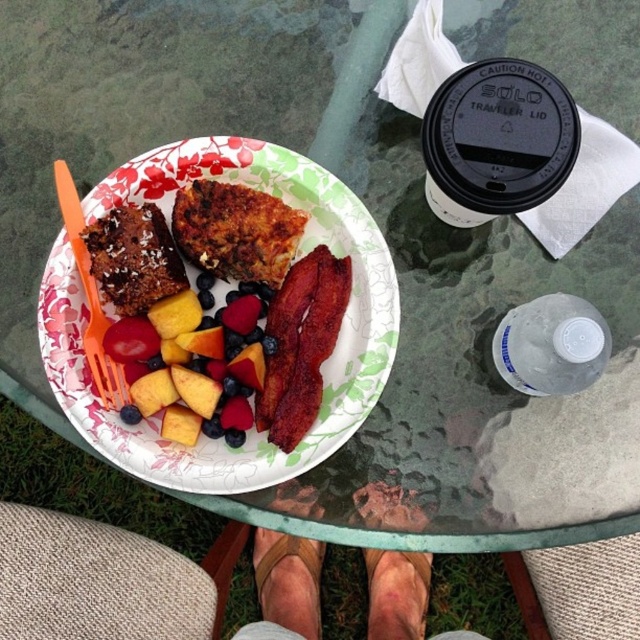
You are setting up for a picnic and need to place the orange plastic fork at upper left and the matte paper plate at center on the table. Based on the image, which object is closer to you?

The matte paper plate at center is closer to you because the orange plastic fork at upper left is behind it.

You are setting up a picnic and need to place the matte paper plate at center and the orange plastic fork at upper left on a small table. The table has limited vertical space. Which item might not fit if the table has a height restriction?

The matte paper plate at center is much taller than the orange plastic fork at upper left, so it might not fit in the table with limited vertical space.

You are a drone operator trying to deliver a small package to the matte paper plate at center. The coordinates given are in a grid system where the bottom left corner is the origin point. What is the exact coordinate point you should aim for?

The exact coordinate point to aim for is (323,364).